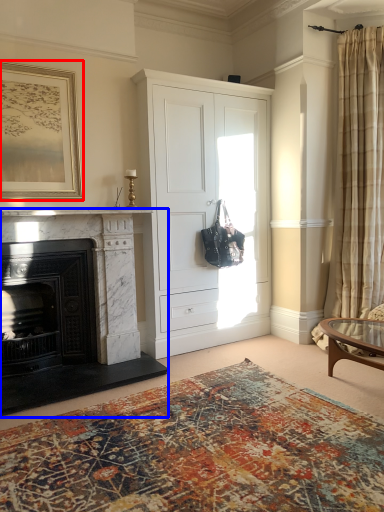
Question: Which point is closer to the camera, picture frame (highlighted by a red box) or fireplace (highlighted by a blue box)?

Choices:
 (A) picture frame
 (B) fireplace

Answer: (B)